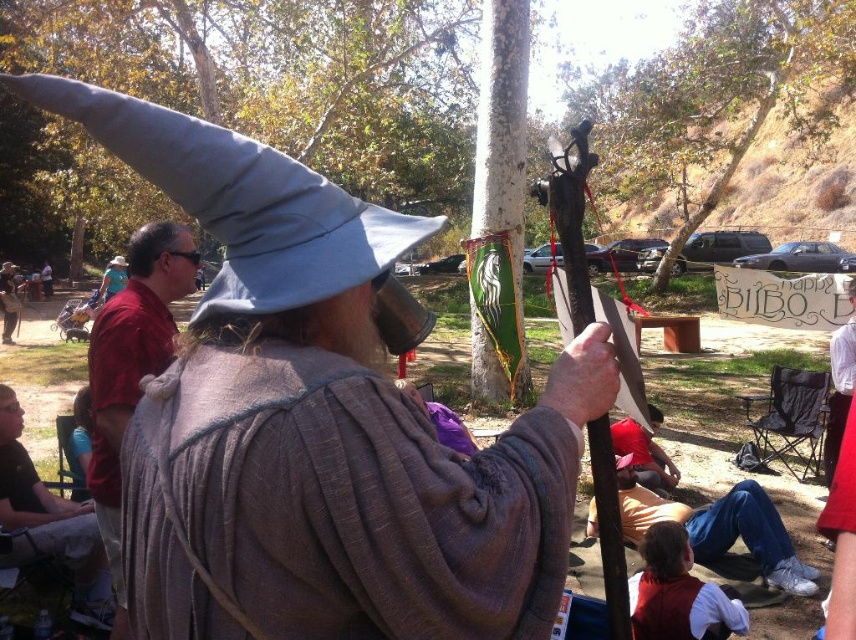
Question: Is matte red shirt at left thinner than brown leather jacket at lower left?

Choices:
 (A) yes
 (B) no

Answer: (A)

Question: Which point is farther to the camera?

Choices:
 (A) (54, 540)
 (B) (183, 269)

Answer: (A)

Question: Among these objects, which one is nearest to the camera?

Choices:
 (A) matte red shirt at left
 (B) brown leather jacket at lower left

Answer: (A)

Question: Can you confirm if matte red shirt at left is positioned to the right of brown leather jacket at lower left?

Choices:
 (A) no
 (B) yes

Answer: (B)

Question: Is matte red shirt at left wider than brown leather jacket at lower left?

Choices:
 (A) yes
 (B) no

Answer: (B)

Question: Which point is closer to the camera?

Choices:
 (A) matte red shirt at left
 (B) brown leather jacket at lower left

Answer: (A)